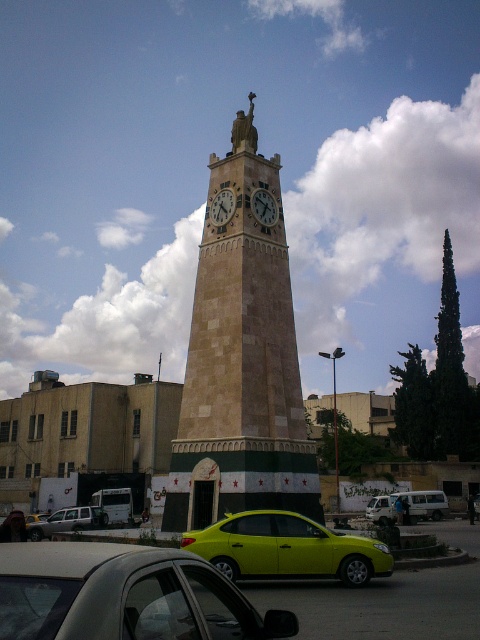
Who is more forward, (x=372, y=560) or (x=62, y=508)?

Point (x=372, y=560) is in front.

Does point (277, 568) come in front of point (99, 525)?

Yes, point (277, 568) is in front of point (99, 525).

Identify the location of neon yellow car at center. Image resolution: width=480 pixels, height=640 pixels. (287, 548).

Describe the element at coordinates (241, 362) in the screenshot. This screenshot has width=480, height=640. I see `beige stone clock tower at center` at that location.

The image size is (480, 640). In order to click on beige stone clock tower at center in this screenshot , I will do `click(241, 362)`.

At what (x,y) coordinates should I click in order to perform the action: click on beige stone clock tower at center. Please return your answer as a coordinate pair (x, y). This screenshot has width=480, height=640. Looking at the image, I should click on (241, 362).

Does stone clock at center have a lesser width compared to wooden clock face at center?

In fact, stone clock at center might be wider than wooden clock face at center.

Can you confirm if stone clock at center is taller than wooden clock face at center?

Correct, stone clock at center is much taller as wooden clock face at center.

Locate an element on the screen. This screenshot has width=480, height=640. stone clock at center is located at coordinates (264, 208).